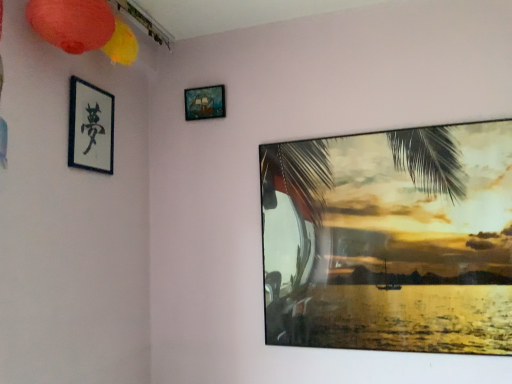
Question: In terms of size, does matte paper lantern at upper left appear bigger or smaller than black paper at upper left, the 1th picture frame when ordered from left to right?

Choices:
 (A) big
 (B) small

Answer: (A)

Question: From the image's perspective, is matte paper lantern at upper left above or below black paper at upper left, the 1th picture frame when ordered from left to right?

Choices:
 (A) above
 (B) below

Answer: (A)

Question: Estimate the real-world distances between objects in this image. Which object is closer to the wooden ship painting at upper center, the second picture frame when ordered from left to right?

Choices:
 (A) black paper at upper left, which ranks as the 3th picture frame in right-to-left order
 (B) matte paper lantern at upper left
 (C) metallic glossy picture frame at upper right, the third picture frame when ordered from left to right

Answer: (A)

Question: Which is nearer to the wooden ship painting at upper center, the 2th picture frame from the right?

Choices:
 (A) matte paper lantern at upper left
 (B) black paper at upper left, the 1th picture frame when ordered from left to right
 (C) metallic glossy picture frame at upper right, the third picture frame when ordered from left to right

Answer: (B)